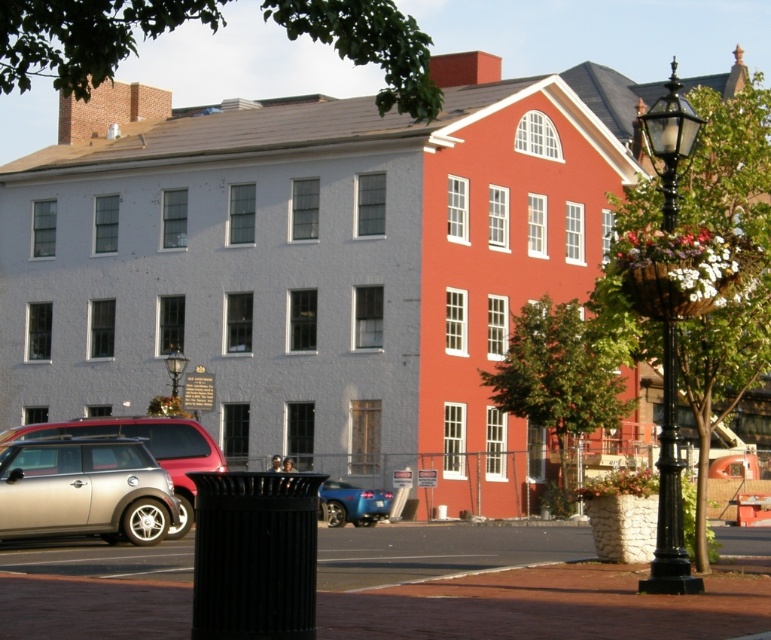
Does point (79, 513) lie behind point (170, 369)?

No.

Does silver metallic car at lower left appear on the right side of black glass lamp post at center?

Yes, silver metallic car at lower left is to the right of black glass lamp post at center.

Who is more distant from viewer, (100, 506) or (174, 372)?

The point (174, 372) is behind.

I want to click on silver metallic car at lower left, so click(x=83, y=490).

Is black metal/texture streetlamp at right to the left of glossy blue car at center from the viewer's perspective?

Incorrect, black metal/texture streetlamp at right is not on the left side of glossy blue car at center.

Is point (689, 577) farther from viewer compared to point (327, 506)?

No, (689, 577) is closer to viewer.

Where is `black metal/texture streetlamp at right`? The height and width of the screenshot is (640, 771). black metal/texture streetlamp at right is located at coordinates (668, 492).

Can you confirm if glossy blue car at center is smaller than black glass lamp post at center?

Yes, glossy blue car at center is smaller than black glass lamp post at center.

Is glossy blue car at center above black glass lamp post at center?

No, glossy blue car at center is not above black glass lamp post at center.

Who is more distant from viewer, (328, 497) or (174, 381)?

Point (174, 381)

This screenshot has width=771, height=640. What are the coordinates of `glossy blue car at center` in the screenshot? It's located at (352, 502).